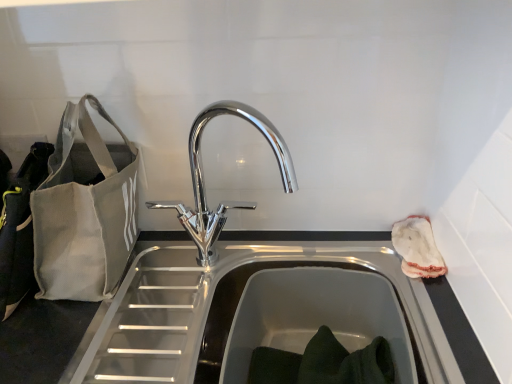
Question: Should I look upward or downward to see gray canvas bag at left?

Choices:
 (A) down
 (B) up

Answer: (A)

Question: From the image's perspective, is white fabric pouch at right on top of gray canvas bag at left?

Choices:
 (A) no
 (B) yes

Answer: (A)

Question: From the image's perspective, is white fabric pouch at right beneath gray canvas bag at left?

Choices:
 (A) no
 (B) yes

Answer: (B)

Question: Can you confirm if white fabric pouch at right is positioned to the left of gray canvas bag at left?

Choices:
 (A) yes
 (B) no

Answer: (B)

Question: Is white fabric pouch at right next to gray canvas bag at left and touching it?

Choices:
 (A) no
 (B) yes

Answer: (A)

Question: Is white fabric pouch at right to the right of gray canvas bag at left from the viewer's perspective?

Choices:
 (A) no
 (B) yes

Answer: (B)

Question: Is white fabric pouch at right completely or partially outside of gray canvas bag at left?

Choices:
 (A) yes
 (B) no

Answer: (A)

Question: Does gray canvas bag at left come in front of white fabric pouch at right?

Choices:
 (A) yes
 (B) no

Answer: (A)

Question: Can you confirm if gray canvas bag at left is smaller than white fabric pouch at right?

Choices:
 (A) yes
 (B) no

Answer: (B)

Question: Does gray canvas bag at left have a lesser width compared to white fabric pouch at right?

Choices:
 (A) no
 (B) yes

Answer: (A)

Question: Is gray canvas bag at left turned away from white fabric pouch at right?

Choices:
 (A) no
 (B) yes

Answer: (A)

Question: Is gray canvas bag at left shorter than white fabric pouch at right?

Choices:
 (A) yes
 (B) no

Answer: (B)

Question: Is gray canvas bag at left behind white fabric pouch at right?

Choices:
 (A) yes
 (B) no

Answer: (B)

Question: Considering the relative positions of chrome metallic faucet at center and white fabric pouch at right in the image provided, is chrome metallic faucet at center in front of white fabric pouch at right?

Choices:
 (A) no
 (B) yes

Answer: (B)